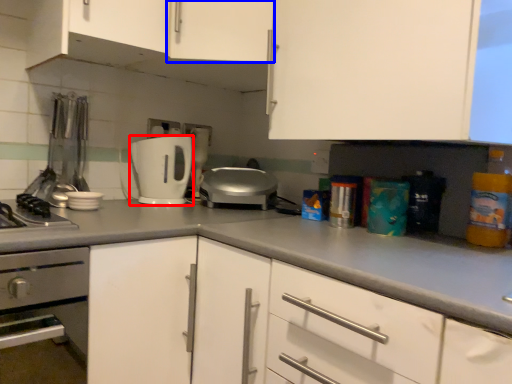
Question: Which of the following is the closest to the observer, toaster (highlighted by a red box) or cabinetry (highlighted by a blue box)?

Choices:
 (A) toaster
 (B) cabinetry

Answer: (B)